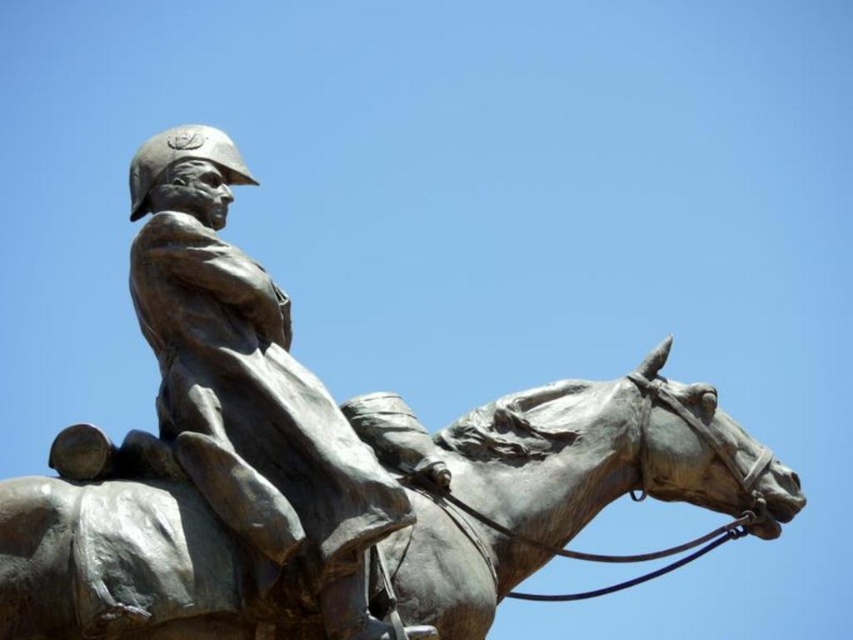
Question: Among these points, which one is farthest from the camera?

Choices:
 (A) (228, 516)
 (B) (543, 435)

Answer: (B)

Question: Where is bronze horse at center located in relation to bronze statue at center in the image?

Choices:
 (A) below
 (B) above

Answer: (A)

Question: Can you confirm if bronze horse at center is smaller than bronze statue at center?

Choices:
 (A) yes
 (B) no

Answer: (A)

Question: In this image, where is bronze horse at center located relative to bronze statue at center?

Choices:
 (A) above
 (B) below

Answer: (B)